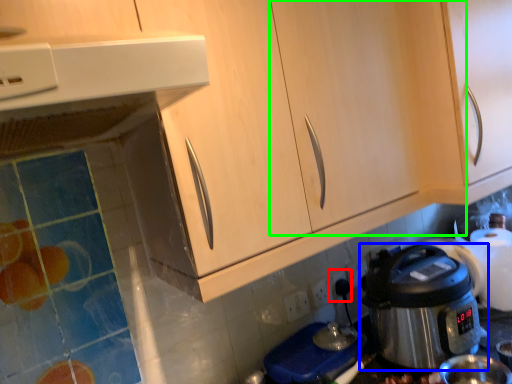
Question: Based on their relative distances, which object is nearer to electric outlet (highlighted by a red box)? Choose from rice cooker (highlighted by a blue box) and cabinetry (highlighted by a green box).

Choices:
 (A) rice cooker
 (B) cabinetry

Answer: (A)